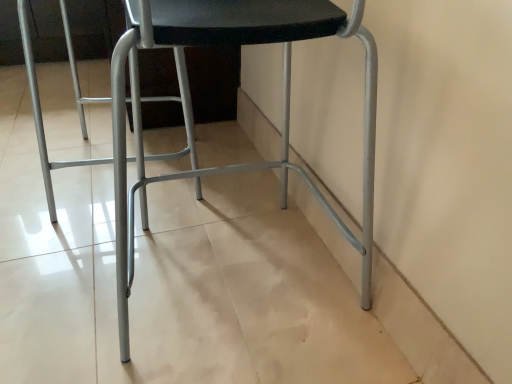
Question: Are metallic gray chair at center and metallic silver swivel chair at center located far from each other?

Choices:
 (A) yes
 (B) no

Answer: (B)

Question: Is metallic gray chair at center bigger than metallic silver swivel chair at center?

Choices:
 (A) yes
 (B) no

Answer: (B)

Question: Does metallic gray chair at center appear on the left side of metallic silver swivel chair at center?

Choices:
 (A) yes
 (B) no

Answer: (B)

Question: From the image's perspective, is metallic gray chair at center on top of metallic silver swivel chair at center?

Choices:
 (A) no
 (B) yes

Answer: (A)

Question: Is metallic gray chair at center in contact with metallic silver swivel chair at center?

Choices:
 (A) no
 (B) yes

Answer: (A)

Question: Considering the relative sizes of metallic gray chair at center and metallic silver swivel chair at center in the image provided, is metallic gray chair at center wider than metallic silver swivel chair at center?

Choices:
 (A) yes
 (B) no

Answer: (B)

Question: Does metallic silver swivel chair at center have a larger size compared to metallic gray chair at center?

Choices:
 (A) no
 (B) yes

Answer: (B)

Question: Does metallic silver swivel chair at center contain metallic gray chair at center?

Choices:
 (A) yes
 (B) no

Answer: (B)

Question: Does metallic silver swivel chair at center have a greater width compared to metallic gray chair at center?

Choices:
 (A) yes
 (B) no

Answer: (A)

Question: Is metallic silver swivel chair at center oriented towards metallic gray chair at center?

Choices:
 (A) no
 (B) yes

Answer: (A)

Question: From the image's perspective, is metallic silver swivel chair at center beneath metallic gray chair at center?

Choices:
 (A) no
 (B) yes

Answer: (A)

Question: From the image's perspective, is metallic silver swivel chair at center over metallic gray chair at center?

Choices:
 (A) yes
 (B) no

Answer: (A)

Question: Considering the positions of metallic gray chair at center and metallic silver swivel chair at center in the image, is metallic gray chair at center wider or thinner than metallic silver swivel chair at center?

Choices:
 (A) thin
 (B) wide

Answer: (A)